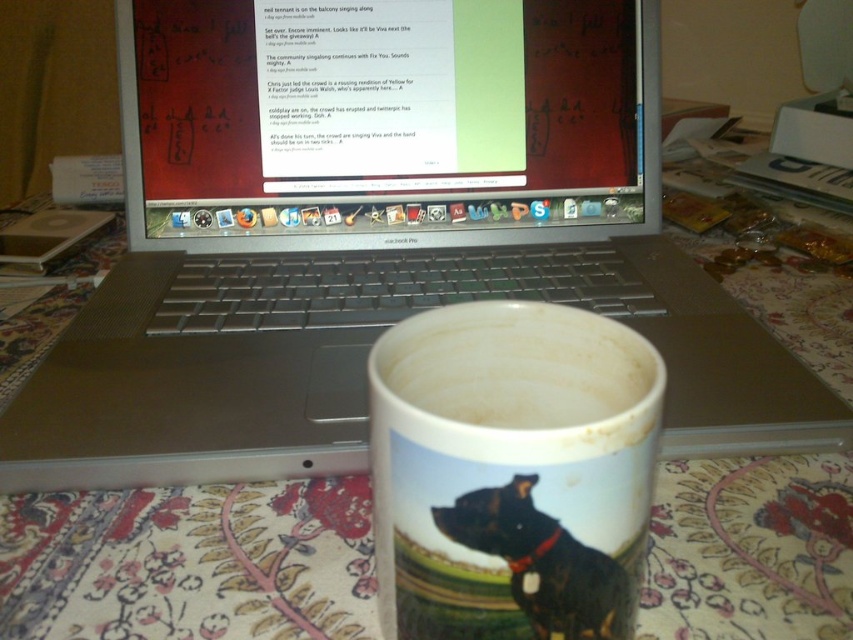
You are a person with a 20 inch arm length. You want to reach the matte plastic monitor at center from your current position. Can you reach it with your arm fully extended?

The matte plastic monitor at center is 20.15 inches away from the viewer. Since your arm is 20 inches long, you cannot quite reach it when fully extended because the distance is slightly longer than your arm length.

Looking at this image, where is the white glossy mug at center located in the image?

The white glossy mug at center is located at point (x=509, y=472) in the image.

You are standing at the point marked as point (x=338, y=76) in the workspace. If you want to reach the edge of the laptop screen, which is 12 inches away from you, can you do it without moving your position?

The distance between you and the edge of the laptop screen is 12 inches, which is less than the 20.66 inches between you and the viewer. Therefore, you can reach it without moving.